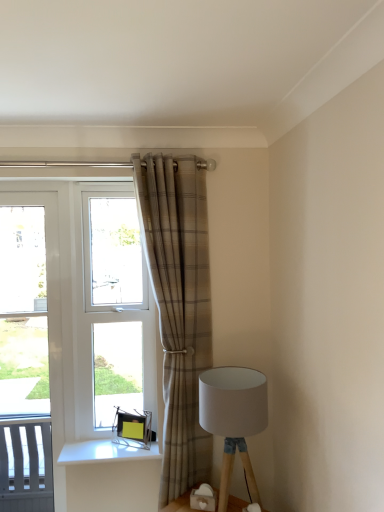
Question: Which is correct: clear glass window at center is inside white plastic screen door at left, or outside of it?

Choices:
 (A) outside
 (B) inside

Answer: (A)

Question: From a real-world perspective, is clear glass window at center above or below white plastic screen door at left?

Choices:
 (A) above
 (B) below

Answer: (A)

Question: Which object is positioned closest to the plaid fabric curtain at center?

Choices:
 (A) white plastic screen door at left
 (B) white fabric lampshade at lower right
 (C) clear glass window at center

Answer: (C)

Question: Which of these objects is positioned farthest from the white fabric lampshade at lower right?

Choices:
 (A) clear glass window at center
 (B) white plastic screen door at left
 (C) plaid fabric curtain at center

Answer: (B)